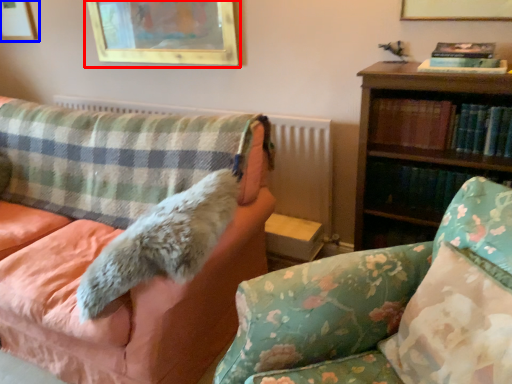
Question: Which of the following is the closest to the observer, picture frame (highlighted by a red box) or picture frame (highlighted by a blue box)?

Choices:
 (A) picture frame
 (B) picture frame

Answer: (A)